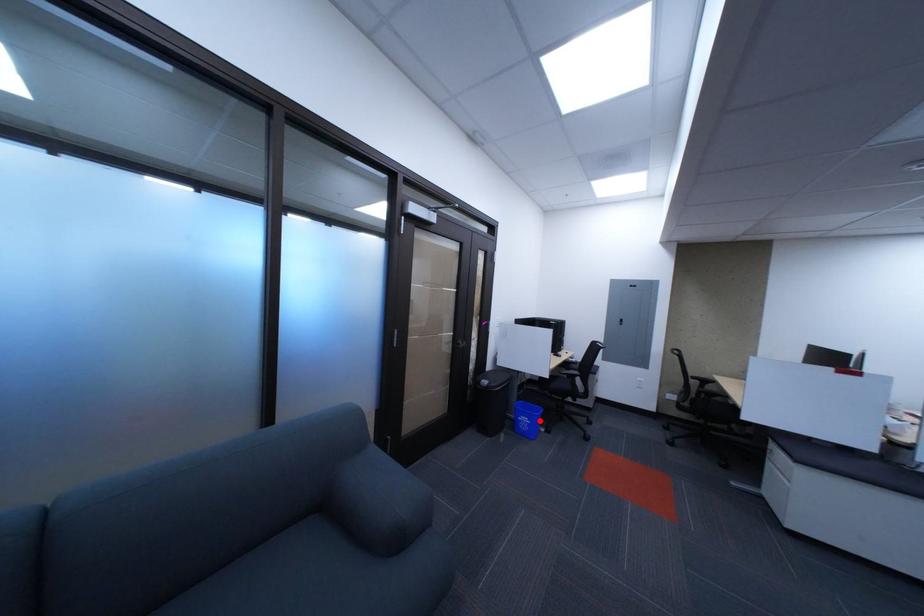
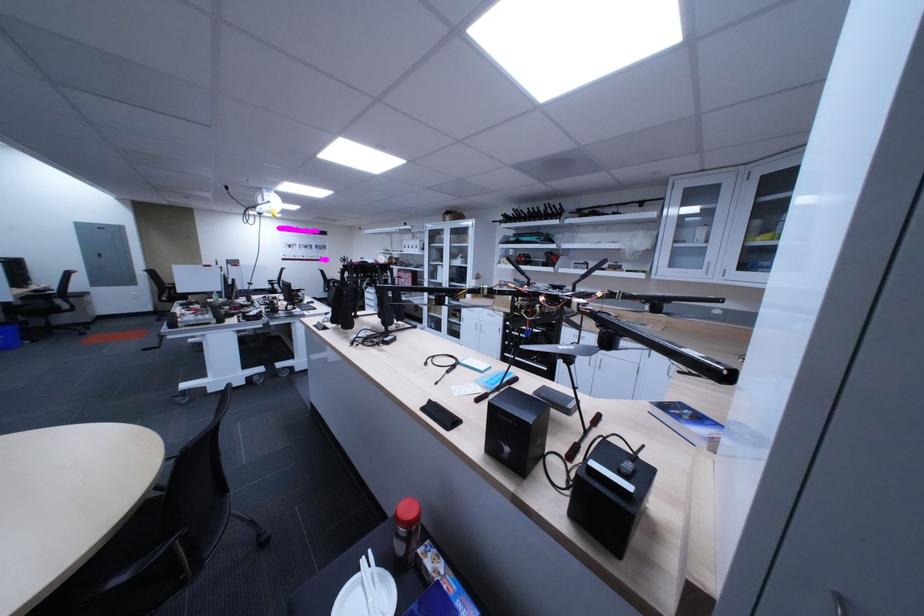
Question: I am providing you with two images of the same scene from different viewpoints. Image1 has a red point marked. In image2, the corresponding 3D location appears at what relative position? Reply with the corresponding letter.

Choices:
 (A) Closer
 (B) Farther

Answer: (B)